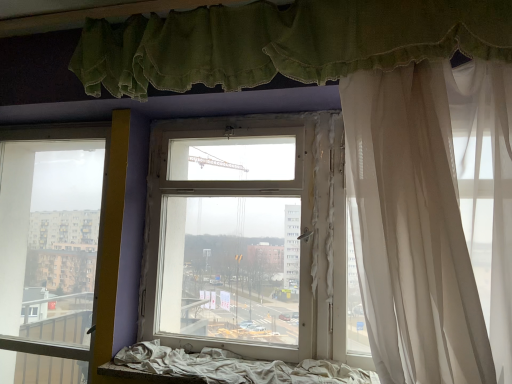
Find the location of a particular element. white sheer curtain at right, positioned as the 1th curtain in bottom-to-top order is located at coordinates (433, 218).

This screenshot has width=512, height=384. Describe the element at coordinates (236, 367) in the screenshot. I see `white fabric bed frame at lower center` at that location.

Measure the distance between point (17, 358) and camera.

The depth of point (17, 358) is 8.39 feet.

Locate an element on the screen. green fabric curtain at upper center, the 2th curtain ordered from the bottom is located at coordinates (283, 43).

The image size is (512, 384). Find the location of `transparent glass window at center, placed as the 2th window when sorted from left to right`. transparent glass window at center, placed as the 2th window when sorted from left to right is located at coordinates (244, 236).

Can you confirm if transparent glass window at left, placed as the first window when sorted from left to right, is positioned to the left of transparent glass window at center, placed as the 2th window when sorted from left to right?

Yes, transparent glass window at left, placed as the first window when sorted from left to right, is to the left of transparent glass window at center, placed as the 2th window when sorted from left to right.

From a real-world perspective, who is located lower, transparent glass window at left, arranged as the 2th window when viewed from the right, or transparent glass window at center, placed as the 2th window when sorted from left to right?

transparent glass window at left, arranged as the 2th window when viewed from the right, is physically lower.

Could you measure the distance between transparent glass window at left, placed as the first window when sorted from left to right, and transparent glass window at center, placed as the 2th window when sorted from left to right?

A distance of 29.89 inches exists between transparent glass window at left, placed as the first window when sorted from left to right, and transparent glass window at center, placed as the 2th window when sorted from left to right.

Relative to transparent glass window at center, which appears as the 1th window when viewed from the right, is transparent glass window at left, placed as the first window when sorted from left to right, in front or behind?

Clearly, transparent glass window at left, placed as the first window when sorted from left to right, is behind transparent glass window at center, which appears as the 1th window when viewed from the right.

Which is in front, point (365, 375) or point (77, 285)?

The point (365, 375) is more forward.

Does white fabric bed frame at lower center have a lesser height compared to transparent glass window at left, placed as the first window when sorted from left to right?

Correct, white fabric bed frame at lower center is not as tall as transparent glass window at left, placed as the first window when sorted from left to right.

Is white fabric bed frame at lower center at the left side of transparent glass window at left, arranged as the 2th window when viewed from the right?

In fact, white fabric bed frame at lower center is to the right of transparent glass window at left, arranged as the 2th window when viewed from the right.

Based on their sizes in the image, would you say transparent glass window at left, arranged as the 2th window when viewed from the right, is bigger or smaller than green fabric curtain at upper center, the 2th curtain ordered from the bottom?

Considering their sizes, transparent glass window at left, arranged as the 2th window when viewed from the right, takes up more space than green fabric curtain at upper center, the 2th curtain ordered from the bottom.

How distant is transparent glass window at left, arranged as the 2th window when viewed from the right, from green fabric curtain at upper center, positioned as the 1th curtain in top-to-bottom order?

transparent glass window at left, arranged as the 2th window when viewed from the right, is 3.93 feet from green fabric curtain at upper center, positioned as the 1th curtain in top-to-bottom order.

Does transparent glass window at left, placed as the first window when sorted from left to right, contain green fabric curtain at upper center, positioned as the 1th curtain in top-to-bottom order?

No, green fabric curtain at upper center, positioned as the 1th curtain in top-to-bottom order, is not inside transparent glass window at left, placed as the first window when sorted from left to right.

How many degrees apart are the facing directions of white sheer curtain at right, the second curtain from the top, and white fabric bed frame at lower center?

They differ by 0.000223 degrees in their facing directions.

Which object is closer to the camera, white sheer curtain at right, the second curtain from the top, or white fabric bed frame at lower center?

white sheer curtain at right, the second curtain from the top, is closer to the camera.

Between white sheer curtain at right, positioned as the 1th curtain in bottom-to-top order, and white fabric bed frame at lower center, which one appears on the left side from the viewer's perspective?

white fabric bed frame at lower center.

Are white sheer curtain at right, the second curtain from the top, and white fabric bed frame at lower center located far from each other?

That's not correct — white sheer curtain at right, the second curtain from the top, is a little close to white fabric bed frame at lower center.

From a real-world perspective, is green fabric curtain at upper center, positioned as the 1th curtain in top-to-bottom order, beneath white sheer curtain at right, positioned as the 1th curtain in bottom-to-top order?

No.

Considering the positions of objects green fabric curtain at upper center, the 2th curtain ordered from the bottom, and white sheer curtain at right, positioned as the 1th curtain in bottom-to-top order, in the image provided, who is more to the right, green fabric curtain at upper center, the 2th curtain ordered from the bottom, or white sheer curtain at right, positioned as the 1th curtain in bottom-to-top order,?

white sheer curtain at right, positioned as the 1th curtain in bottom-to-top order.

Is point (113, 35) more distant than point (469, 184)?

Yes, it is.

Where is `curtain below the green fabric curtain at upper center, the 2th curtain ordered from the bottom (from the image's perspective)`? curtain below the green fabric curtain at upper center, the 2th curtain ordered from the bottom (from the image's perspective) is located at coordinates (433, 218).

Between transparent glass window at center, placed as the 2th window when sorted from left to right, and transparent glass window at left, arranged as the 2th window when viewed from the right, which one has larger size?

transparent glass window at left, arranged as the 2th window when viewed from the right, is bigger.

Can you confirm if transparent glass window at center, which appears as the 1th window when viewed from the right, is positioned to the right of transparent glass window at left, placed as the first window when sorted from left to right?

Indeed, transparent glass window at center, which appears as the 1th window when viewed from the right, is positioned on the right side of transparent glass window at left, placed as the first window when sorted from left to right.

From a real-world perspective, does transparent glass window at center, placed as the 2th window when sorted from left to right, sit lower than transparent glass window at left, arranged as the 2th window when viewed from the right?

Incorrect, from a real-world perspective, transparent glass window at center, placed as the 2th window when sorted from left to right, is higher than transparent glass window at left, arranged as the 2th window when viewed from the right.

Which of these two, transparent glass window at center, placed as the 2th window when sorted from left to right, or transparent glass window at left, arranged as the 2th window when viewed from the right, stands shorter?

transparent glass window at center, placed as the 2th window when sorted from left to right, is shorter.

Is transparent glass window at center, placed as the 2th window when sorted from left to right, next to green fabric curtain at upper center, positioned as the 1th curtain in top-to-bottom order?

transparent glass window at center, placed as the 2th window when sorted from left to right, and green fabric curtain at upper center, positioned as the 1th curtain in top-to-bottom order, are not in contact.

Looking at this image, from a real-world perspective, is transparent glass window at center, which appears as the 1th window when viewed from the right, on green fabric curtain at upper center, positioned as the 1th curtain in top-to-bottom order?

Actually, transparent glass window at center, which appears as the 1th window when viewed from the right, is physically below green fabric curtain at upper center, positioned as the 1th curtain in top-to-bottom order, in the real world.

Is transparent glass window at center, placed as the 2th window when sorted from left to right, smaller than green fabric curtain at upper center, the 2th curtain ordered from the bottom?

Correct, transparent glass window at center, placed as the 2th window when sorted from left to right, occupies less space than green fabric curtain at upper center, the 2th curtain ordered from the bottom.

How far apart are transparent glass window at center, placed as the 2th window when sorted from left to right, and green fabric curtain at upper center, the 2th curtain ordered from the bottom?

transparent glass window at center, placed as the 2th window when sorted from left to right, and green fabric curtain at upper center, the 2th curtain ordered from the bottom, are 27.20 inches apart.

This screenshot has width=512, height=384. I want to click on window below the transparent glass window at center, placed as the 2th window when sorted from left to right (from the image's perspective), so click(x=49, y=250).

Where is `bed frame that is on the right side of transparent glass window at left, arranged as the 2th window when viewed from the right`? This screenshot has width=512, height=384. bed frame that is on the right side of transparent glass window at left, arranged as the 2th window when viewed from the right is located at coordinates (236, 367).

Which object lies nearer to the anchor point transparent glass window at center, which appears as the 1th window when viewed from the right, transparent glass window at left, arranged as the 2th window when viewed from the right, or white sheer curtain at right, positioned as the 1th curtain in bottom-to-top order?

Based on the image, white sheer curtain at right, positioned as the 1th curtain in bottom-to-top order, appears to be nearer to transparent glass window at center, which appears as the 1th window when viewed from the right.

Consider the image. Which object lies further to the anchor point transparent glass window at left, arranged as the 2th window when viewed from the right, white sheer curtain at right, positioned as the 1th curtain in bottom-to-top order, or transparent glass window at center, placed as the 2th window when sorted from left to right?

white sheer curtain at right, positioned as the 1th curtain in bottom-to-top order, is further to transparent glass window at left, arranged as the 2th window when viewed from the right.

Based on their spatial positions, is transparent glass window at center, which appears as the 1th window when viewed from the right, or green fabric curtain at upper center, positioned as the 1th curtain in top-to-bottom order, further from white sheer curtain at right, the second curtain from the top?

transparent glass window at center, which appears as the 1th window when viewed from the right, is positioned further to the anchor white sheer curtain at right, the second curtain from the top.

When comparing their distances from transparent glass window at left, arranged as the 2th window when viewed from the right, does white fabric bed frame at lower center or white sheer curtain at right, the second curtain from the top, seem closer?

white fabric bed frame at lower center.

Considering their positions, is transparent glass window at left, placed as the first window when sorted from left to right, positioned further to white fabric bed frame at lower center than white sheer curtain at right, positioned as the 1th curtain in bottom-to-top order?

transparent glass window at left, placed as the first window when sorted from left to right, is positioned further to the anchor white fabric bed frame at lower center.

Estimate the real-world distances between objects in this image. Which object is further from green fabric curtain at upper center, positioned as the 1th curtain in top-to-bottom order, transparent glass window at center, which appears as the 1th window when viewed from the right, or transparent glass window at left, placed as the first window when sorted from left to right?

transparent glass window at left, placed as the first window when sorted from left to right, is positioned further to the anchor green fabric curtain at upper center, positioned as the 1th curtain in top-to-bottom order.

From the image, which object appears to be farther from white sheer curtain at right, positioned as the 1th curtain in bottom-to-top order, green fabric curtain at upper center, positioned as the 1th curtain in top-to-bottom order, or transparent glass window at left, placed as the first window when sorted from left to right?

transparent glass window at left, placed as the first window when sorted from left to right, is further to white sheer curtain at right, positioned as the 1th curtain in bottom-to-top order.

Considering their positions, is white sheer curtain at right, positioned as the 1th curtain in bottom-to-top order, positioned closer to green fabric curtain at upper center, the 2th curtain ordered from the bottom, than white fabric bed frame at lower center?

Among the two, white sheer curtain at right, positioned as the 1th curtain in bottom-to-top order, is located nearer to green fabric curtain at upper center, the 2th curtain ordered from the bottom.

You are a GUI agent. You are given a task and a screenshot of the screen. Output one action in this format:
    pyautogui.click(x=<x>, y=<y>)
    Task: Click on the bed frame between transparent glass window at left, placed as the first window when sorted from left to right, and transparent glass window at center, placed as the 2th window when sorted from left to right, in the horizontal direction
    
    Given the screenshot: What is the action you would take?
    pyautogui.click(x=236, y=367)

The width and height of the screenshot is (512, 384). I want to click on curtain between green fabric curtain at upper center, the 2th curtain ordered from the bottom, and white fabric bed frame at lower center in the up-down direction, so click(x=433, y=218).

Locate an element on the screen. This screenshot has width=512, height=384. bed frame between transparent glass window at left, placed as the first window when sorted from left to right, and white sheer curtain at right, the second curtain from the top is located at coordinates (236, 367).

Identify the location of window between transparent glass window at left, arranged as the 2th window when viewed from the right, and white sheer curtain at right, the second curtain from the top, in the horizontal direction. This screenshot has height=384, width=512. (244, 236).